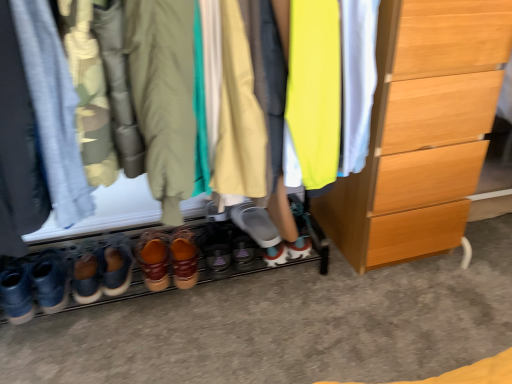
This screenshot has width=512, height=384. Identify the location of free space in front of leather shoes at lower center. (160, 340).